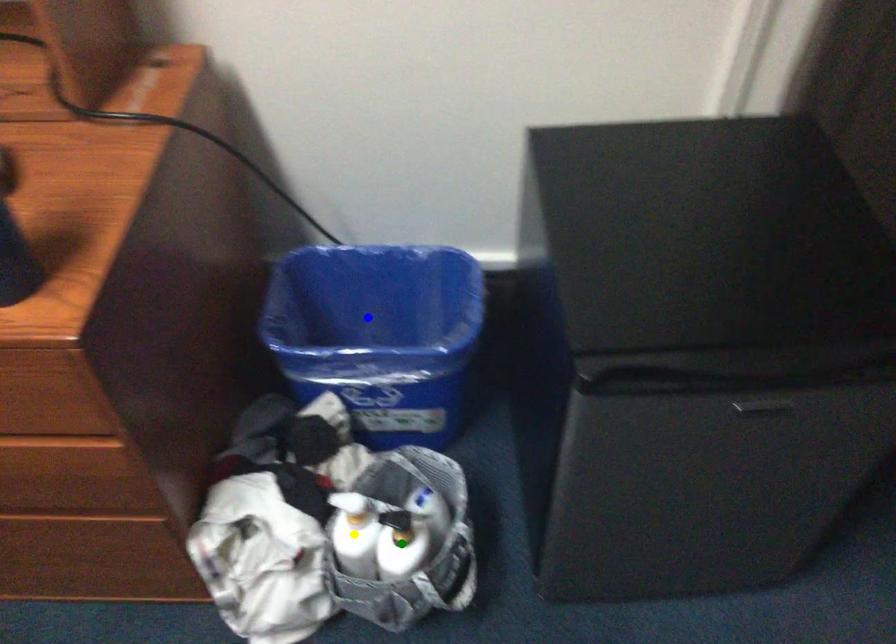
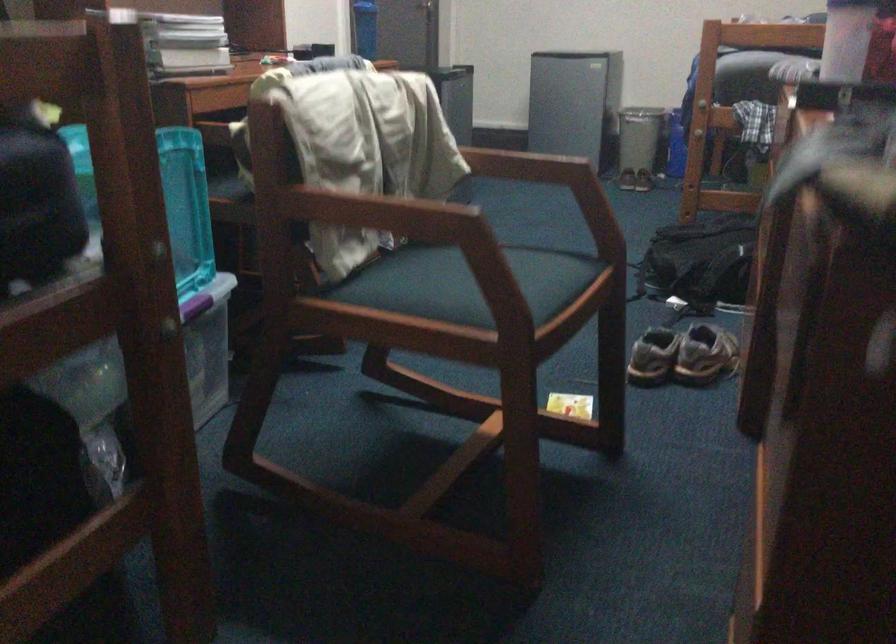
I am providing you with two images of the same scene from different viewpoints. Three points are marked in image1. Which point corresponds to a part or object that is occluded in image2?In image1, three points are marked. Which of them correspond to a part or object that is occluded in image2?Among the three points shown in image1, which one corresponds to a part or object that is no longer visible due to occlusion in image2?

yellow point, green point, blue point cannot be seen in image2.